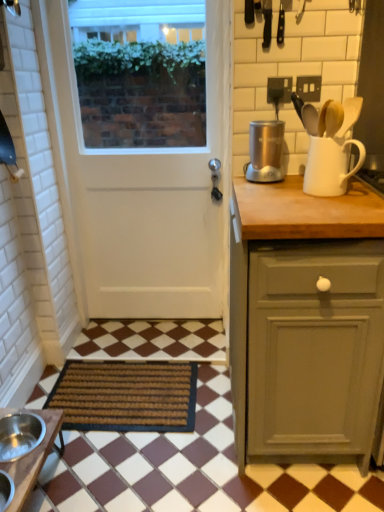
Question: In the image, is white matte door at center on the left side or the right side of matte gray cabinet at right?

Choices:
 (A) right
 (B) left

Answer: (B)

Question: From their relative heights in the image, would you say white matte door at center is taller or shorter than matte gray cabinet at right?

Choices:
 (A) short
 (B) tall

Answer: (B)

Question: Considering the real-world distances, which object is farthest from the shiny metallic spoon at upper right?

Choices:
 (A) brown woven mat at lower left
 (B) satin silver appliance at upper right
 (C) matte gray cabinet at right
 (D) brown wooden table at lower left
 (E) white matte door at center

Answer: (D)

Question: Which is nearer to the brown wooden table at lower left?

Choices:
 (A) brown woven mat at lower left
 (B) satin silver appliance at upper right
 (C) matte gray cabinet at right
 (D) white matte jug at upper right
 (E) white matte door at center

Answer: (A)